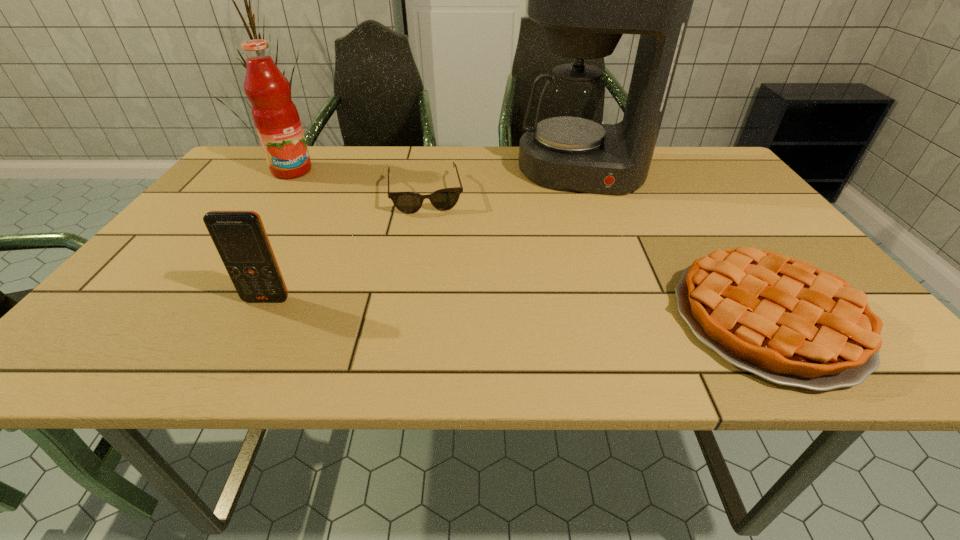
This screenshot has width=960, height=540. I want to click on the fourth object from right to left, so click(x=240, y=238).

Locate an element on the screen. the third tallest object is located at coordinates click(x=240, y=238).

Locate an element on the screen. The height and width of the screenshot is (540, 960). pie is located at coordinates (785, 320).

Find the location of a particular element. sunglasses is located at coordinates (444, 199).

The height and width of the screenshot is (540, 960). What are the coordinates of `coffee maker` in the screenshot? It's located at (585, 0).

Locate an element on the screen. This screenshot has height=540, width=960. fruit juice is located at coordinates [275, 116].

Locate an element on the screen. This screenshot has height=540, width=960. the leftmost object is located at coordinates (275, 116).

This screenshot has width=960, height=540. Find the location of `vacant space situated 0.270m on the left of the pie`. vacant space situated 0.270m on the left of the pie is located at coordinates (536, 319).

I want to click on free region located 0.100m on the front lenses of the sunglasses, so (x=431, y=238).

Locate an element on the screen. free spot located 0.210m on the front lenses of the sunglasses is located at coordinates (435, 267).